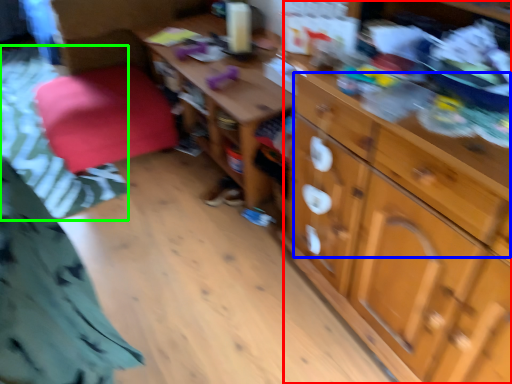
Question: Which is farther away from cabinetry (highlighted by a red box)? drawer (highlighted by a blue box) or bedding (highlighted by a green box)?

Choices:
 (A) drawer
 (B) bedding

Answer: (B)